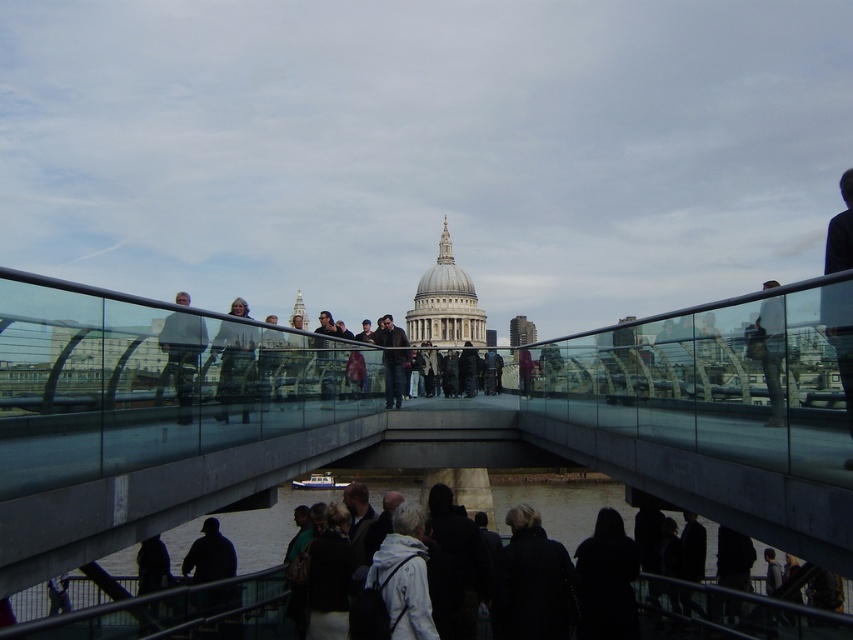
You are a photographer trying to capture a reflection of the dark gray sweater at lower center in the glass panels of the glass pedestrian bridge at center. Based on their relative heights, will the sweater be visible in the reflection?

The glass pedestrian bridge at center is much taller than the dark gray sweater at lower center, so the sweater will not be visible in the reflection because the bridge is too tall for the reflection to reach that height.

You are standing at point (415, 420) on the pedestrian bridge. What object are you standing on?

You are standing on the glass pedestrian bridge at center located at point (415, 420).